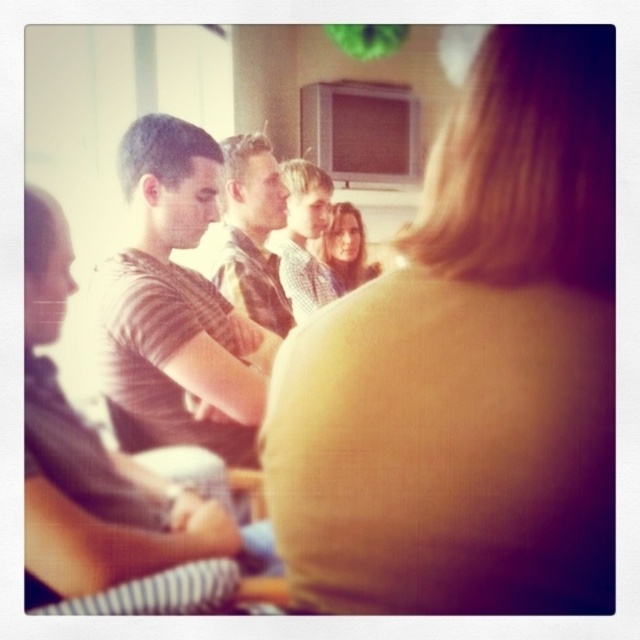
Question: From the image, what is the correct spatial relationship of camouflage shirt at center in relation to light brown shirt at center?

Choices:
 (A) below
 (B) above

Answer: (A)

Question: Which point is farther to the camera?

Choices:
 (A) (200, 412)
 (B) (547, 348)
 (C) (304, 308)
 (D) (348, 280)

Answer: (D)

Question: Does camouflage shirt at center have a larger size compared to light brown shirt at center?

Choices:
 (A) yes
 (B) no

Answer: (A)

Question: Considering the real-world distances, which object is closest to the matte yellow shirt at center?

Choices:
 (A) smooth skin face at center
 (B) camouflage shirt at center
 (C) light brown shirt at center

Answer: (B)

Question: Based on their relative distances, which object is farther from the matte yellow shirt at center?

Choices:
 (A) light brown shirt at center
 (B) striped cotton shirt at center
 (C) smooth skin face at center
 (D) camouflage shirt at center

Answer: (C)

Question: Can you confirm if matte yellow shirt at center is thinner than light brown shirt at center?

Choices:
 (A) yes
 (B) no

Answer: (A)